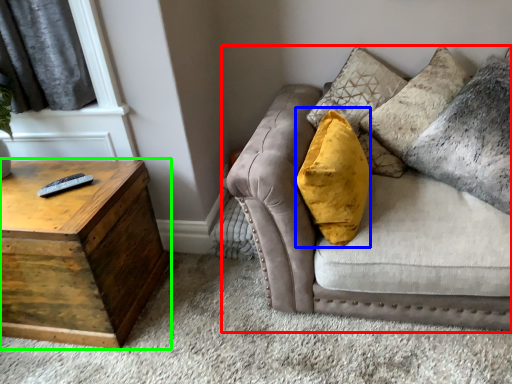
Question: Which is farther away from studio couch (highlighted by a red box)? throw pillow (highlighted by a blue box) or table (highlighted by a green box)?

Choices:
 (A) throw pillow
 (B) table

Answer: (B)